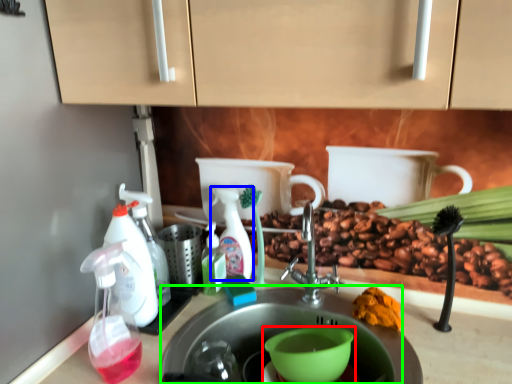
Question: Which object is the closest to the coffee cup (highlighted by a red box)? Choose among these: cleaning product (highlighted by a blue box) or sink (highlighted by a green box).

Choices:
 (A) cleaning product
 (B) sink

Answer: (B)